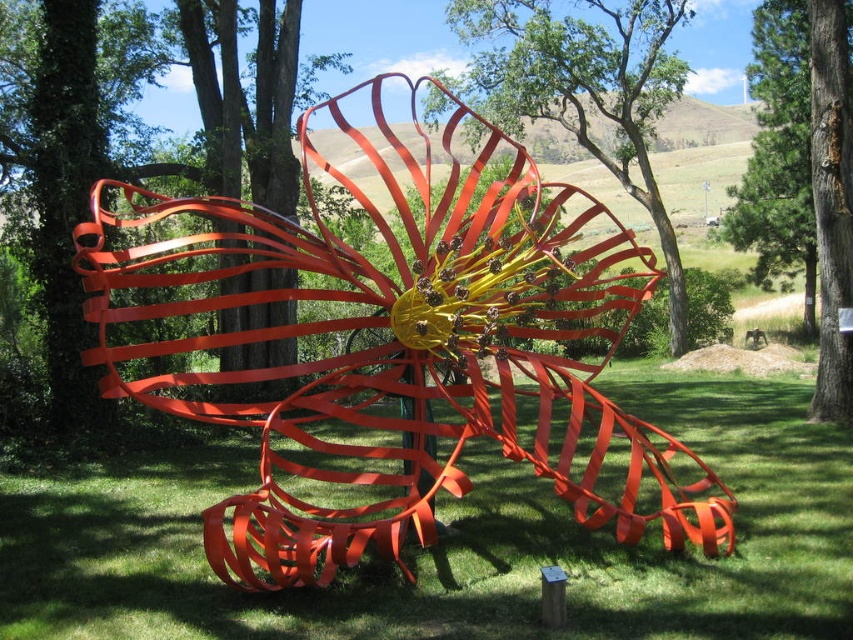
The image size is (853, 640). What do you see at coordinates (457, 544) in the screenshot? I see `glossy orange sculpture at center` at bounding box center [457, 544].

Between point (476, 513) and point (730, 209), which one is positioned behind?

The point (730, 209) is behind.

You are a GUI agent. You are given a task and a screenshot of the screen. Output one action in this format:
    pyautogui.click(x=<x>, y=<y>)
    Task: Click on the glossy orange sculpture at center
    This screenshot has height=640, width=853.
    Given the screenshot: What is the action you would take?
    pyautogui.click(x=457, y=544)

Consider the image. Does green leafy tree at center lie behind green textured tree at upper right?

Yes.

Between point (483, 33) and point (807, 76), which one is positioned in front?

Positioned in front is point (807, 76).

Find the location of a particular element. green leafy tree at center is located at coordinates (584, 90).

Does glossy orange sculpture at center come in front of smooth bark tree at center?

Yes, it is.

Which is behind, point (701, 573) or point (811, 112)?

Positioned behind is point (811, 112).

You are a GUI agent. You are given a task and a screenshot of the screen. Output one action in this format:
    pyautogui.click(x=<x>, y=<y>)
    Task: Click on the glossy orange sculpture at center
    
    Given the screenshot: What is the action you would take?
    pyautogui.click(x=457, y=544)